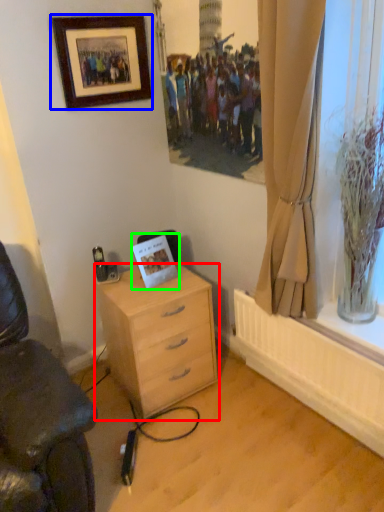
Question: Estimate the real-world distances between objects in this image. Which object is farther from desk (highlighted by a red box), picture frame (highlighted by a blue box) or postcard (highlighted by a green box)?

Choices:
 (A) picture frame
 (B) postcard

Answer: (A)